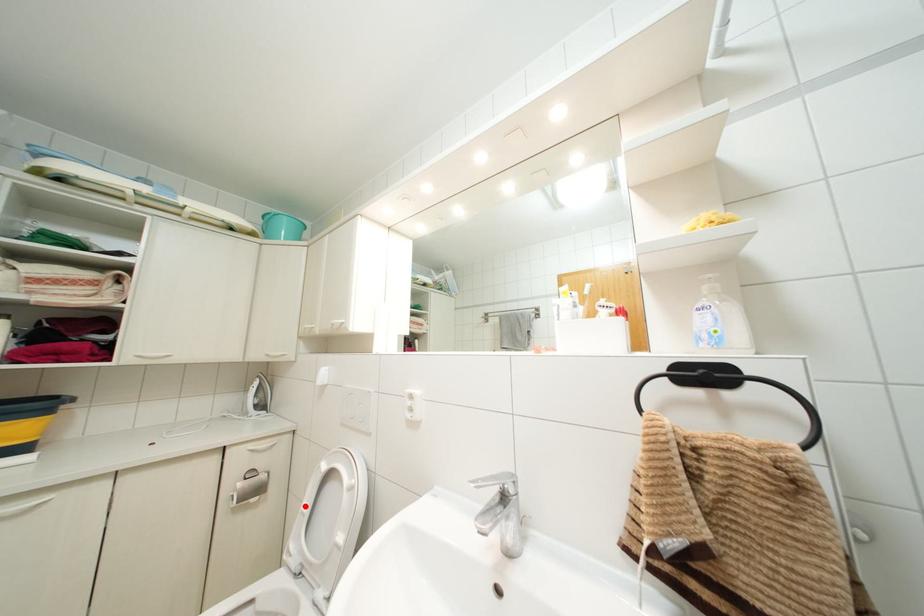
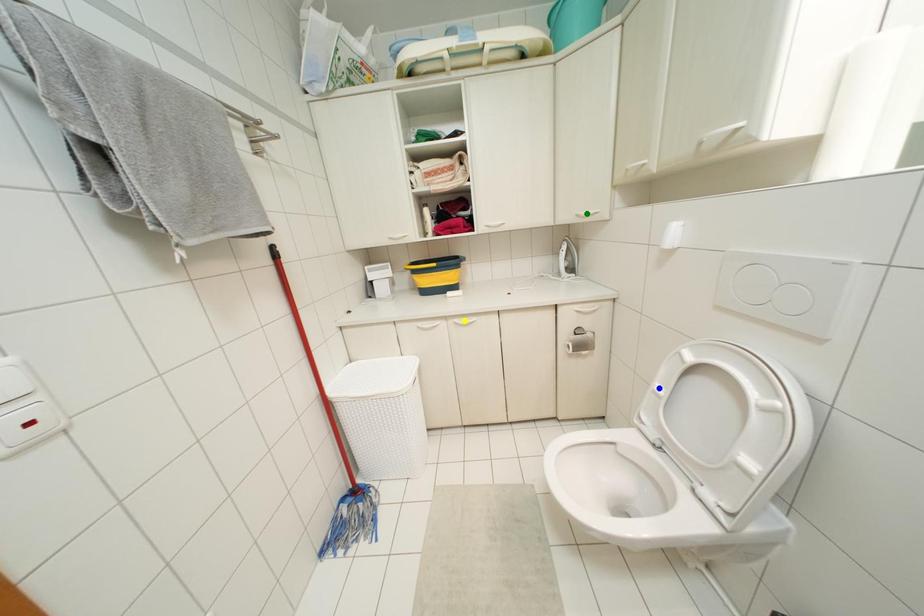
Question: I am providing you with two images of the same scene from different viewpoints. A red point is marked on the first image. You are given multiple points on the second image. In image 2, which mark is for the same physical point as the one in image 1?

Choices:
 (A) green point
 (B) yellow point
 (C) blue point

Answer: (C)